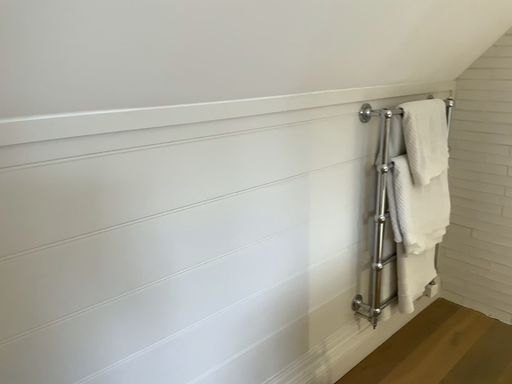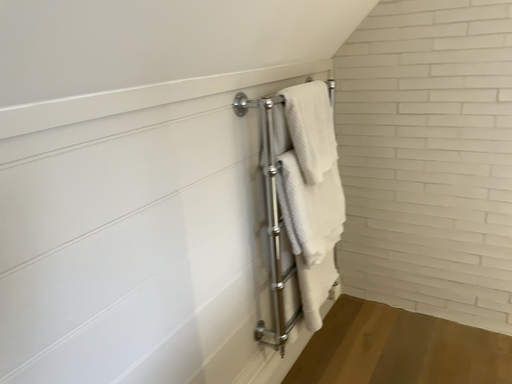
Question: Which way did the camera rotate in the video?

Choices:
 (A) rotated left
 (B) rotated right

Answer: (B)